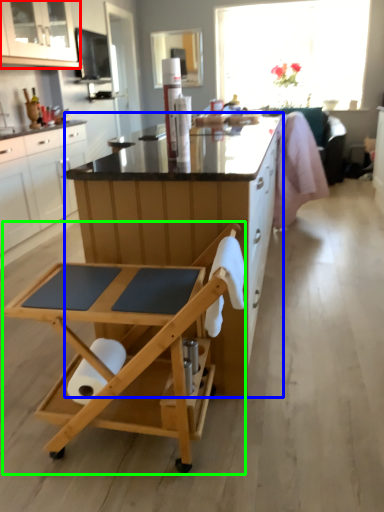
Question: Considering the real-world distances, which object is farthest from cabinetry (highlighted by a red box)? desk (highlighted by a blue box) or table (highlighted by a green box)?

Choices:
 (A) desk
 (B) table

Answer: (B)